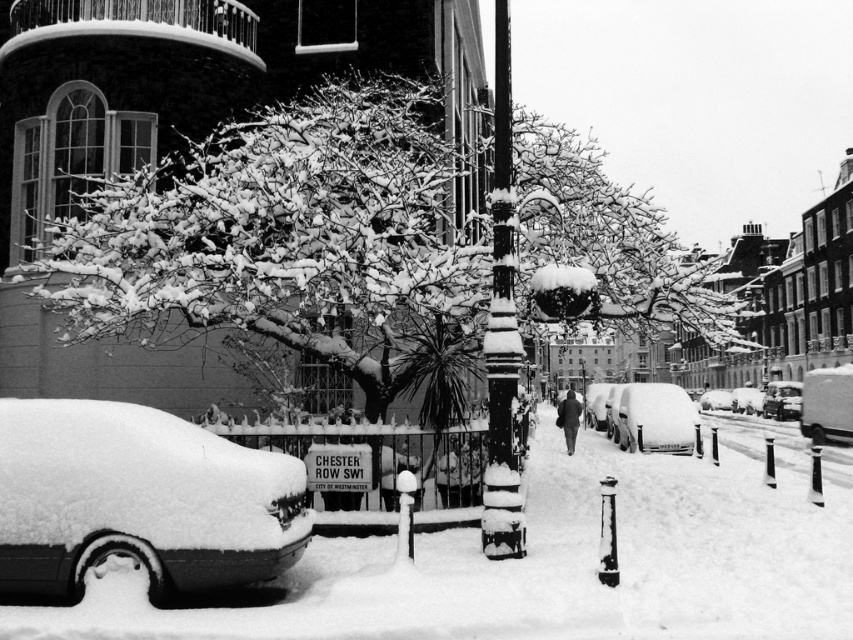
Question: Among these points, which one is nearest to the camera?

Choices:
 (A) (799, 406)
 (B) (219, 563)
 (C) (720, 397)
 (D) (343, 296)

Answer: (B)

Question: Which object is farther from the camera taking this photo?

Choices:
 (A) snow-covered van at center
 (B) metallic silver car at center

Answer: (B)

Question: Can you confirm if snow-covered branches at center is positioned to the left of metallic silver car at center-right?

Choices:
 (A) yes
 (B) no

Answer: (A)

Question: Is shiny silver car at center to the right of metallic silver van at center from the viewer's perspective?

Choices:
 (A) no
 (B) yes

Answer: (A)

Question: Does snow-covered car at left have a smaller size compared to snow-covered van at center?

Choices:
 (A) yes
 (B) no

Answer: (A)

Question: Among these points, which one is nearest to the camera?

Choices:
 (A) (244, 579)
 (B) (505, 36)

Answer: (A)